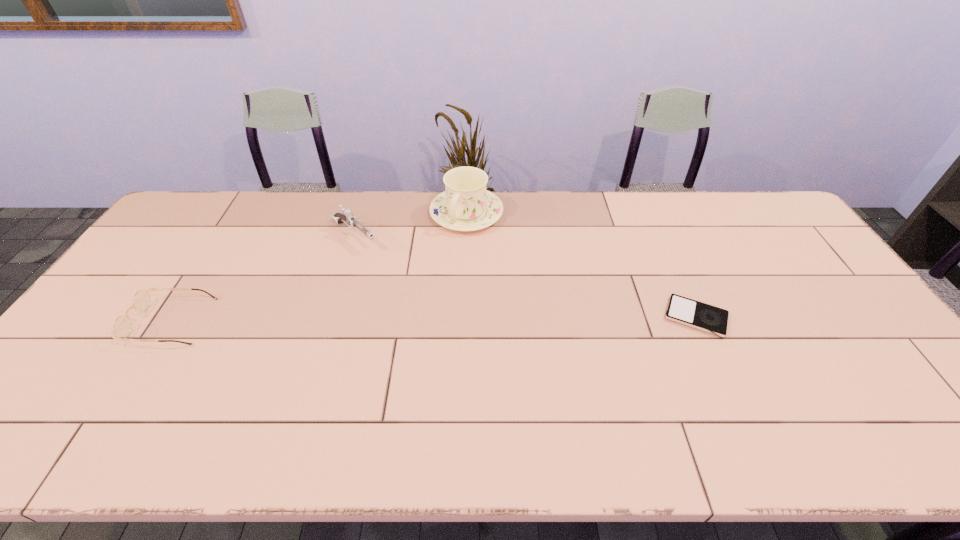
You are a GUI agent. You are given a task and a screenshot of the screen. Output one action in this format:
    pyautogui.click(x=<x>, y=<y>)
    Task: Click on the free spot on the desktop that is between the third tallest object and the iPod and is positioned aimed along the barrel of the second tallest object
    Image resolution: width=960 pixels, height=540 pixels.
    Given the screenshot: What is the action you would take?
    453,319

Where is `vacant space on the desktop that is between the spectacles and the rightmost object and is positioned on the handle side of the tallest object`? The width and height of the screenshot is (960, 540). vacant space on the desktop that is between the spectacles and the rightmost object and is positioned on the handle side of the tallest object is located at coordinates (400, 319).